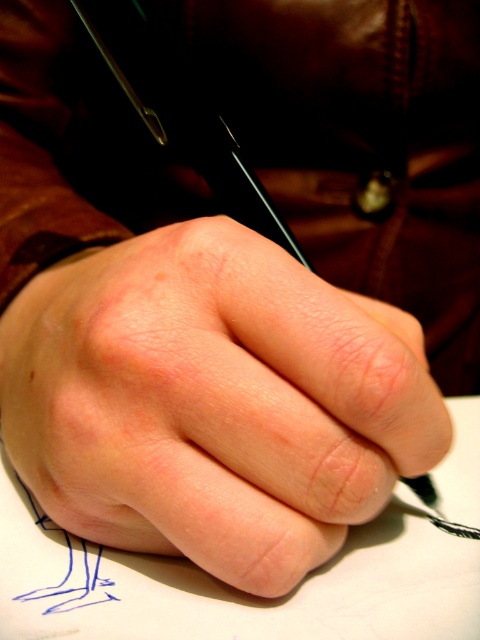
Is point (278, 448) more distant than point (110, 19)?

No, (278, 448) is closer to viewer.

Is smooth skin hand at center positioned behind black metallic pencil at center?

That is False.

Who is more distant from viewer, [267,276] or [201,120]?

The point [201,120] is more distant.

Locate an element on the screen. The width and height of the screenshot is (480, 640). smooth skin hand at center is located at coordinates (213, 401).